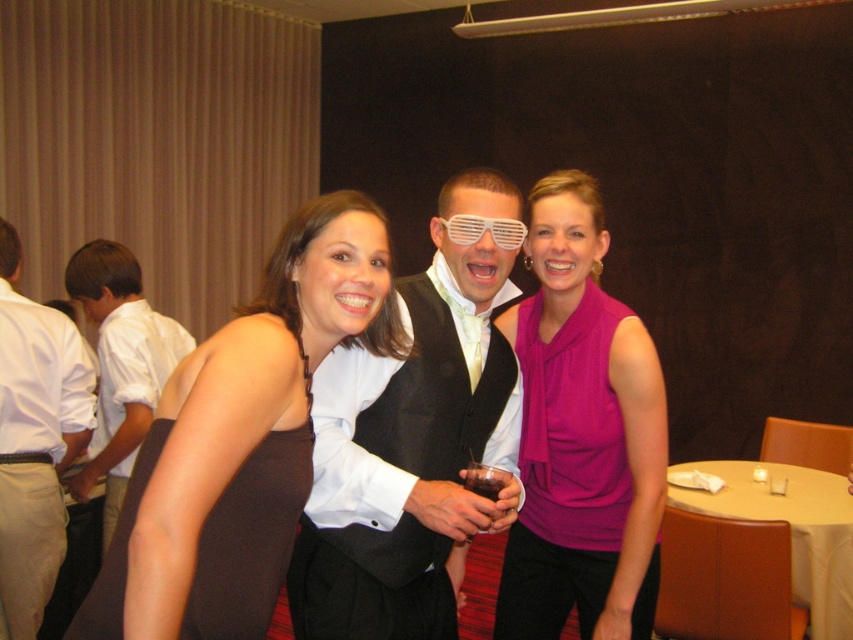
Is purple silky blouse at center positioned at the back of white shirt at left?

No, it is in front of white shirt at left.

Which is more to the right, purple silky blouse at center or white shirt at left?

Positioned to the right is purple silky blouse at center.

Locate an element on the screen. purple silky blouse at center is located at coordinates (581, 435).

You are a GUI agent. You are given a task and a screenshot of the screen. Output one action in this format:
    pyautogui.click(x=<x>, y=<y>)
    Task: Click on the brown satin dress at center
    
    Given the screenshot: What is the action you would take?
    pyautogui.click(x=242, y=438)

Is brown satin dress at center shorter than white glossy vest at center?

Correct, brown satin dress at center is not as tall as white glossy vest at center.

Does point (247, 490) come farther from viewer compared to point (329, 442)?

No.

Find the location of `brown satin dress at center`. brown satin dress at center is located at coordinates (242, 438).

Is brown satin dress at center to the left of purple silky blouse at center from the viewer's perspective?

Correct, you'll find brown satin dress at center to the left of purple silky blouse at center.

Where is `brown satin dress at center`? Image resolution: width=853 pixels, height=640 pixels. brown satin dress at center is located at coordinates (242, 438).

At what (x,y) coordinates should I click in order to perform the action: click on brown satin dress at center. Please return your answer as a coordinate pair (x, y). The image size is (853, 640). Looking at the image, I should click on (242, 438).